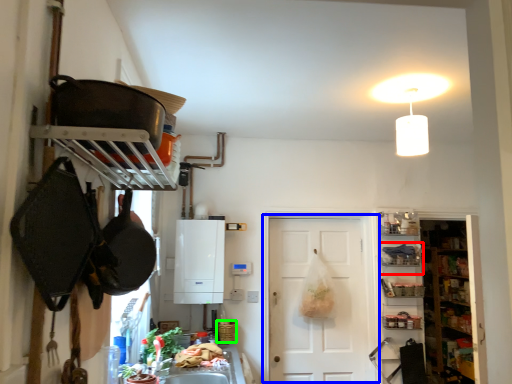
Question: Which object is the farthest from shelf (highlighted by a red box)? Choose among these: door (highlighted by a blue box) or basket (highlighted by a green box).

Choices:
 (A) door
 (B) basket

Answer: (B)